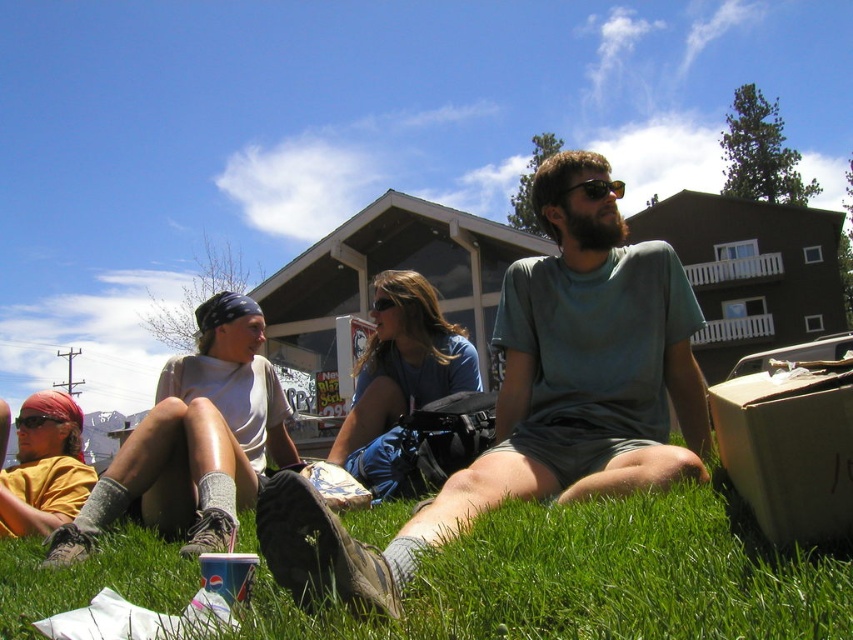
Question: Which of the following is the farthest from the observer?

Choices:
 (A) (610, 216)
 (B) (26, 428)
 (C) (601, 538)

Answer: (B)

Question: Which object appears farthest from the camera in this image?

Choices:
 (A) gray cotton t-shirt at center
 (B) green grass at lower center
 (C) matte black goggles at center

Answer: (C)

Question: Which object appears farthest from the camera in this image?

Choices:
 (A) green grass at lower center
 (B) gray cotton t-shirt at center

Answer: (B)

Question: Is gray cotton t-shirt at center to the right of matte black goggles at center from the viewer's perspective?

Choices:
 (A) yes
 (B) no

Answer: (A)

Question: From the image, what is the correct spatial relationship of gray cotton t-shirt at center in relation to matte black goggles at center?

Choices:
 (A) right
 (B) left

Answer: (A)

Question: In this image, where is gray cotton t-shirt at center located relative to matte black goggles at center?

Choices:
 (A) left
 (B) right

Answer: (B)